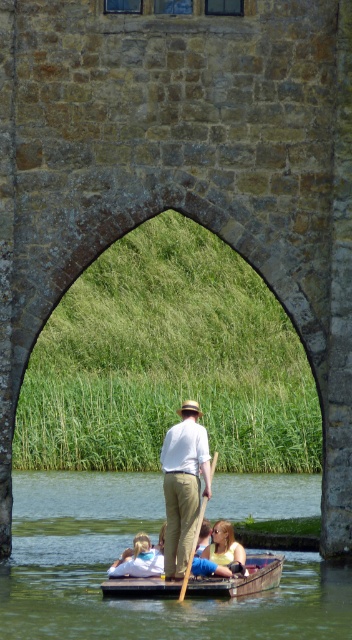
You are navigating a small wooden punt on calm water and notice the khaki cotton pants at center. Based on their position, can you determine if they are closer to the front or the back of the punt?

The khaki cotton pants at center is located at point [183,484], which indicates they are closer to the back of the punt since the coordinates suggest a position near the rear section.

You are standing in the punt and want to reach the point closer to you. Which point should you move towards, point at (171, 541) or point at (197, 520)?

You should move towards point at (171, 541) because it is closer to you than point at (197, 520).

You are standing at the origin point in the scene. Where is the green smooth water at center located in terms of coordinates?

The green smooth water at center is located at coordinates point [117,556].